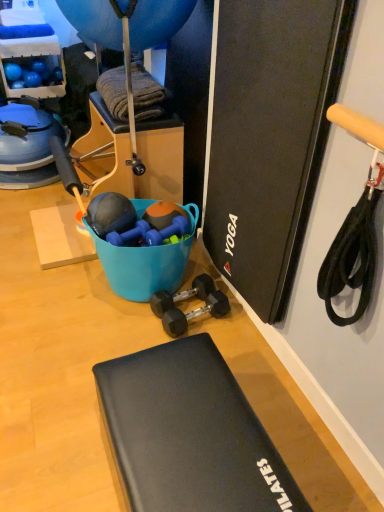
Question: Is black rubber dumbbell at center, which is counted as the 1th dumbbell, starting from the bottom, further to the viewer compared to blue rubber balloon at upper center?

Choices:
 (A) no
 (B) yes

Answer: (B)

Question: Is blue rubber balloon at upper center completely or partially inside black rubber dumbbell at center, which is counted as the 1th dumbbell, starting from the bottom?

Choices:
 (A) yes
 (B) no

Answer: (B)

Question: Is black rubber dumbbell at center, which is counted as the 1th dumbbell, starting from the bottom, positioned with its back to blue rubber balloon at upper center?

Choices:
 (A) no
 (B) yes

Answer: (A)

Question: Considering the relative positions of black rubber dumbbell at center, which is counted as the 1th dumbbell, starting from the bottom, and blue rubber balloon at upper center in the image provided, is black rubber dumbbell at center, which is counted as the 1th dumbbell, starting from the bottom, in front of blue rubber balloon at upper center?

Choices:
 (A) no
 (B) yes

Answer: (A)

Question: Is black rubber dumbbell at center, which is counted as the 1th dumbbell, starting from the bottom, outside of blue rubber balloon at upper center?

Choices:
 (A) yes
 (B) no

Answer: (A)

Question: Looking at the image, does black rubber dumbbell at center, which is counted as the 1th dumbbell, starting from the bottom, seem bigger or smaller compared to blue rubber balloon at upper center?

Choices:
 (A) big
 (B) small

Answer: (B)

Question: Is point (188, 316) positioned closer to the camera than point (84, 31)?

Choices:
 (A) closer
 (B) farther

Answer: (B)

Question: In terms of height, does black rubber dumbbell at center, marked as the third dumbbell in a top-to-bottom arrangement, look taller or shorter compared to blue rubber balloon at upper center?

Choices:
 (A) short
 (B) tall

Answer: (A)

Question: Would you say black rubber dumbbell at center, marked as the third dumbbell in a top-to-bottom arrangement, is inside or outside blue rubber balloon at upper center?

Choices:
 (A) inside
 (B) outside

Answer: (B)

Question: Choose the correct answer: Is blue rubber dumbbell at center, placed as the first dumbbell when sorted from top to bottom, inside black rubber dumbbells at center, which is the 2th dumbbell from bottom to top, or outside it?

Choices:
 (A) inside
 (B) outside

Answer: (B)

Question: In terms of size, does blue rubber dumbbell at center, placed as the first dumbbell when sorted from top to bottom, appear bigger or smaller than black rubber dumbbells at center, which is the 2th dumbbell from bottom to top?

Choices:
 (A) big
 (B) small

Answer: (B)

Question: Is blue rubber dumbbell at center, placed as the 3th dumbbell when sorted from bottom to top, wider or thinner than black rubber dumbbells at center, arranged as the 2th dumbbell when viewed from the top?

Choices:
 (A) wide
 (B) thin

Answer: (B)

Question: From a real-world perspective, is blue rubber dumbbell at center, placed as the 3th dumbbell when sorted from bottom to top, physically located above or below black rubber dumbbells at center, which is the 2th dumbbell from bottom to top?

Choices:
 (A) below
 (B) above

Answer: (B)

Question: From a real-world perspective, is black rubber exercise mat at lower center above or below blue rubber balloon at upper center?

Choices:
 (A) above
 (B) below

Answer: (B)

Question: Is point (246, 438) positioned closer to the camera than point (109, 11)?

Choices:
 (A) closer
 (B) farther

Answer: (A)